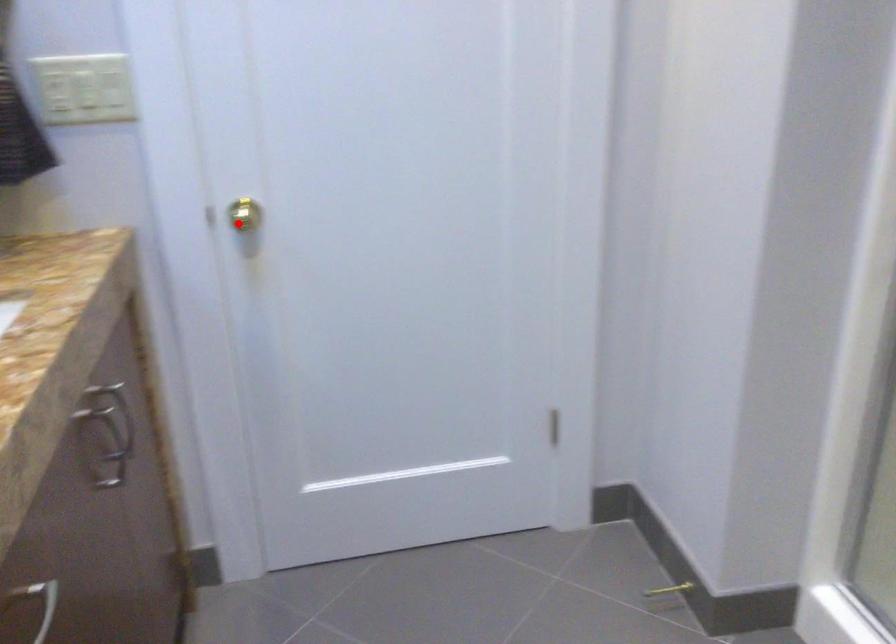
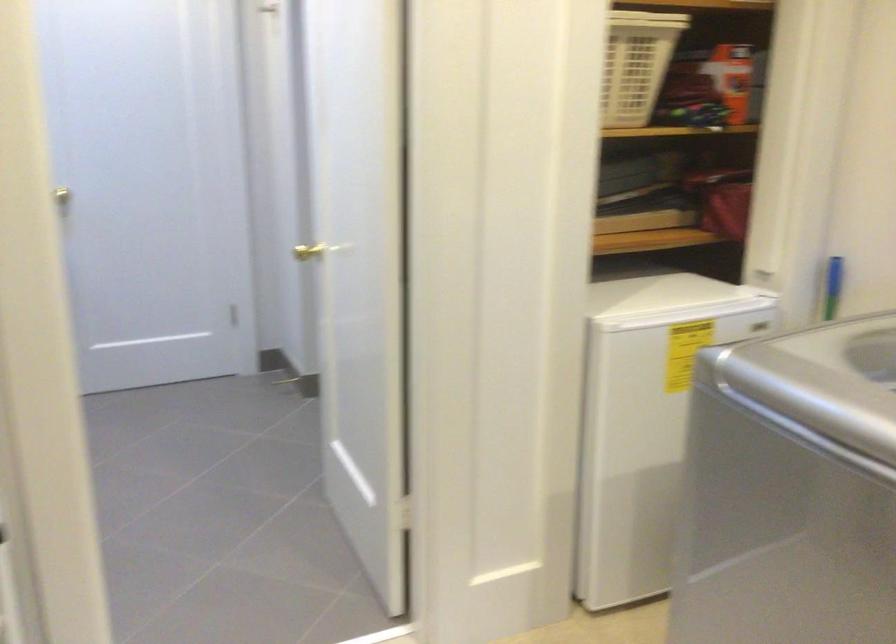
Find the pixel in the second image that matches the highlighted location in the first image.

(71, 192)